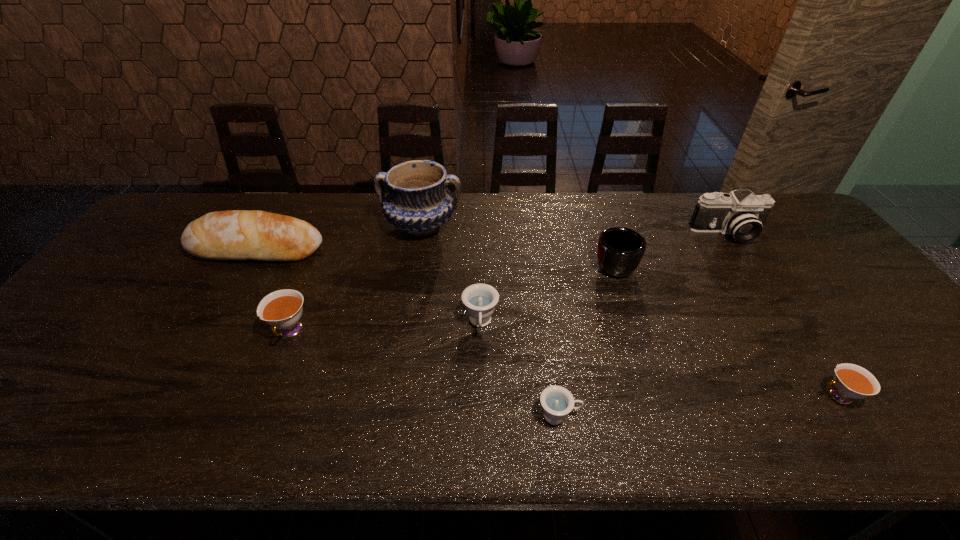
The height and width of the screenshot is (540, 960). Find the location of `free spot between the black camera and the tallest object`. free spot between the black camera and the tallest object is located at coordinates 574,229.

Where is `blank region between the second teacup from right to left and the bigger white teacup`? Image resolution: width=960 pixels, height=540 pixels. blank region between the second teacup from right to left and the bigger white teacup is located at coordinates (424, 374).

Locate an element on the screen. This screenshot has width=960, height=540. empty space that is in between the smaller white teacup and the bread is located at coordinates (547, 322).

Identify which object is the fourth nearest to the mug. Please provide its 2D coordinates. Your answer should be formatted as a tuple, i.e. [(x, y)], where the tuple contains the x and y coordinates of a point satisfying the conditions above.

[(557, 402)]

Locate which object is the closest to the black camera. Please provide its 2D coordinates. Your answer should be formatted as a tuple, i.e. [(x, y)], where the tuple contains the x and y coordinates of a point satisfying the conditions above.

[(620, 250)]

Select which teacup appears as the second closest to the farther white teacup. Please provide its 2D coordinates. Your answer should be formatted as a tuple, i.e. [(x, y)], where the tuple contains the x and y coordinates of a point satisfying the conditions above.

[(557, 402)]

Locate an element on the screen. the closest teacup to the mug is located at coordinates (480, 300).

You are a GUI agent. You are given a task and a screenshot of the screen. Output one action in this format:
    pyautogui.click(x=<x>, y=<y>)
    Task: Click on the vacant position in the image that satisfies the following two spatial constraints: 1. on the side of the camera with the handle; 2. on the right side of the red mug
    
    Given the screenshot: What is the action you would take?
    pyautogui.click(x=604, y=233)

Find the location of `blank space that satisfies the following two spatial constraints: 1. on the back side of the bread; 2. on the left side of the black camera`. blank space that satisfies the following two spatial constraints: 1. on the back side of the bread; 2. on the left side of the black camera is located at coordinates (266, 233).